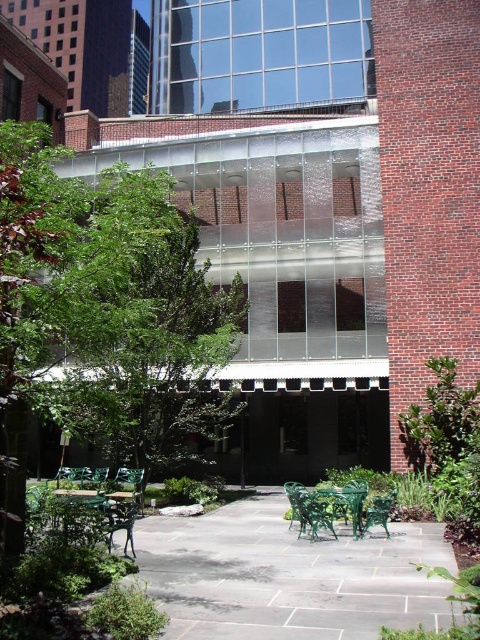
You are planning to install a new lighting fixture in the courtyard. The fixture needs to be placed between the green leafy tree at center and the green metal park bench at center. Considering their heights, which object should the lighting fixture be positioned closer to to avoid casting a shadow on the other?

The green leafy tree at center is taller than the green metal park bench at center. To avoid casting a shadow, the lighting fixture should be positioned closer to the green leafy tree at center.

You are planning to host a small gathering in the courtyard and need to seat 4 people comfortably. Given the green metal table at lower left and the green metal park bench at center, which option would allow more people to sit comfortably?

The green metal table at lower left has a larger size compared to the green metal park bench at center, so it can accommodate more people comfortably.

You are planning to set up a small picnic area in the courtyard. The picnic blanket you have is 20 feet long. If you want to place it between the green leafy tree at center and the green metal park bench at center, will the blanket be long enough to cover the space between them?

The distance between the green leafy tree at center and the green metal park bench at center is 20.29 feet. Since the picnic blanket is only 20 feet long, it will be 0.29 feet short and won not cover the entire space between them.